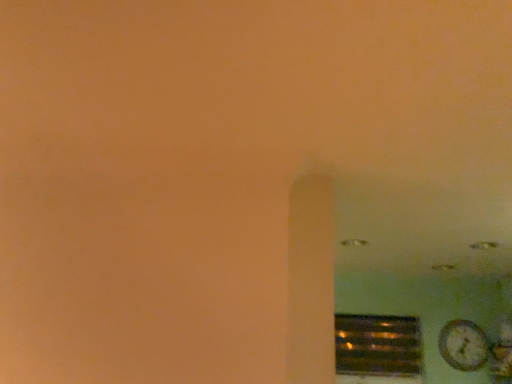
This screenshot has height=384, width=512. Identify the location of wooden textured clock at lower right. (463, 345).

The width and height of the screenshot is (512, 384). What do you see at coordinates (463, 345) in the screenshot?
I see `wooden textured clock at lower right` at bounding box center [463, 345].

Locate an element on the screen. metallic reflective vent at lower right is located at coordinates (378, 349).

What do you see at coordinates (378, 349) in the screenshot?
I see `metallic reflective vent at lower right` at bounding box center [378, 349].

Identify the location of wooden textured clock at lower right. This screenshot has height=384, width=512. (463, 345).

Considering the relative positions of wooden textured clock at lower right and metallic reflective vent at lower right in the image provided, is wooden textured clock at lower right to the left or to the right of metallic reflective vent at lower right?

From the image, it's evident that wooden textured clock at lower right is to the right of metallic reflective vent at lower right.

Is wooden textured clock at lower right closer to camera compared to metallic reflective vent at lower right?

That is True.

Is point (462, 363) closer to viewer compared to point (383, 344)?

Yes, it is in front of point (383, 344).

From the image's perspective, relative to metallic reflective vent at lower right, is wooden textured clock at lower right above or below?

Clearly, from the image's perspective, wooden textured clock at lower right is above metallic reflective vent at lower right.

From a real-world perspective, is wooden textured clock at lower right beneath metallic reflective vent at lower right?

No, from a real-world perspective, wooden textured clock at lower right is not below metallic reflective vent at lower right.

Can you confirm if wooden textured clock at lower right is thinner than metallic reflective vent at lower right?

Yes.

Does wooden textured clock at lower right have a lesser height compared to metallic reflective vent at lower right?

Yes.

Is wooden textured clock at lower right bigger than metallic reflective vent at lower right?

Actually, wooden textured clock at lower right might be smaller than metallic reflective vent at lower right.

Would you say wooden textured clock at lower right is inside or outside metallic reflective vent at lower right?

wooden textured clock at lower right is located beyond the bounds of metallic reflective vent at lower right.

Is wooden textured clock at lower right far away from metallic reflective vent at lower right?

They are positioned close to each other.

Could you tell me if wooden textured clock at lower right is facing metallic reflective vent at lower right?

No, wooden textured clock at lower right is not aimed at metallic reflective vent at lower right.

This screenshot has height=384, width=512. In order to click on window behind the wooden textured clock at lower right in this screenshot , I will do `click(378, 349)`.

Which is more to the right, metallic reflective vent at lower right or wooden textured clock at lower right?

wooden textured clock at lower right is more to the right.

In the image, is metallic reflective vent at lower right positioned in front of or behind wooden textured clock at lower right?

Clearly, metallic reflective vent at lower right is behind wooden textured clock at lower right.

Between point (356, 362) and point (468, 339), which one is positioned in front?

The point (468, 339) is more forward.

From the image's perspective, would you say metallic reflective vent at lower right is positioned over wooden textured clock at lower right?

No.

From a real-world perspective, which object stands above the other?

wooden textured clock at lower right is physically above.

Looking at their sizes, would you say metallic reflective vent at lower right is wider or thinner than wooden textured clock at lower right?

Considering their sizes, metallic reflective vent at lower right looks broader than wooden textured clock at lower right.

Does metallic reflective vent at lower right have a lesser height compared to wooden textured clock at lower right?

In fact, metallic reflective vent at lower right may be taller than wooden textured clock at lower right.

Is metallic reflective vent at lower right smaller than wooden textured clock at lower right?

Actually, metallic reflective vent at lower right might be larger than wooden textured clock at lower right.

Can wooden textured clock at lower right be found inside metallic reflective vent at lower right?

No, wooden textured clock at lower right is located outside of metallic reflective vent at lower right.

Would you say metallic reflective vent at lower right is a long distance from wooden textured clock at lower right?

No, metallic reflective vent at lower right is not far away from wooden textured clock at lower right.

Is metallic reflective vent at lower right looking in the opposite direction of wooden textured clock at lower right?

No, metallic reflective vent at lower right is not facing the opposite direction of wooden textured clock at lower right.

Image resolution: width=512 pixels, height=384 pixels. What are the coordinates of `window that appears below the wooden textured clock at lower right (from the image's perspective)` in the screenshot? It's located at (378, 349).

You are a GUI agent. You are given a task and a screenshot of the screen. Output one action in this format:
    pyautogui.click(x=<x>, y=<y>)
    Task: Click on the window on the left of the wooden textured clock at lower right
    The width and height of the screenshot is (512, 384).
    Given the screenshot: What is the action you would take?
    pyautogui.click(x=378, y=349)

This screenshot has height=384, width=512. I want to click on window below the wooden textured clock at lower right (from the image's perspective), so click(378, 349).